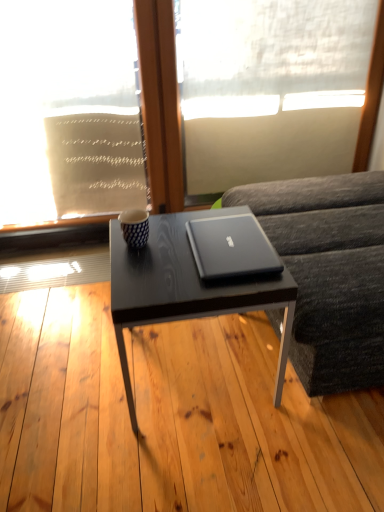
This screenshot has width=384, height=512. Find the location of `free space that is to the left of satin black laptop at center`. free space that is to the left of satin black laptop at center is located at coordinates (158, 259).